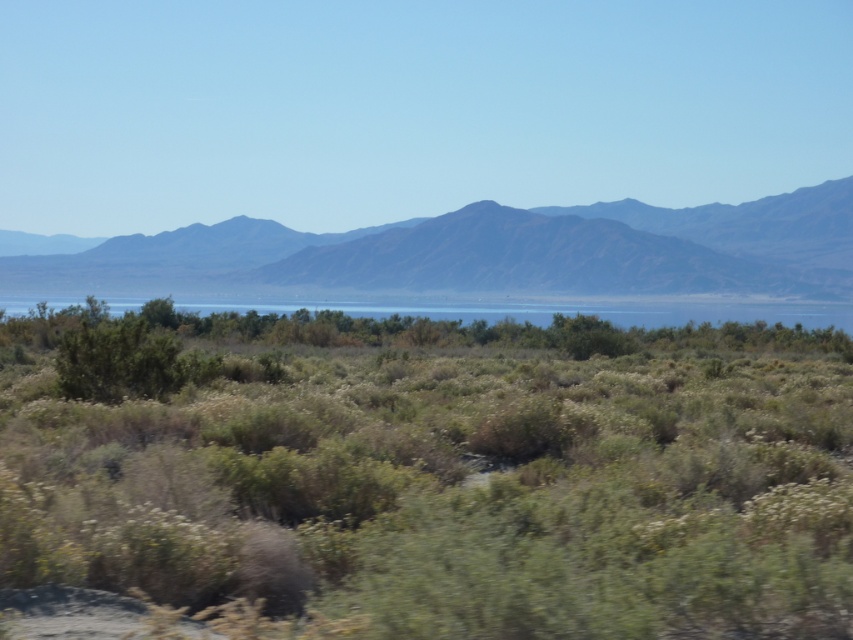
Based on the scene description, where is the green shrubbery at center located in terms of its 2D coordinates?

The green shrubbery at center is located at the 2D coordinates of point (438, 477).

You are a hiker trying to navigate through the desert. You see the green shrubbery at center and the rugged brown mountain at center. Which one is closer to you?

The green shrubbery at center is closer to you because it is shorter than the rugged brown mountain at center, which is further away.

You are a hiker planning to cross the clear blue water at center and reach the rugged brown mountain at center. Based on the scene description, which object would you encounter first if you start from the foreground?

The clear blue water at center would be encountered first because it is located in the midground, closer to the foreground than the rugged brown mountain at center which is in the background.